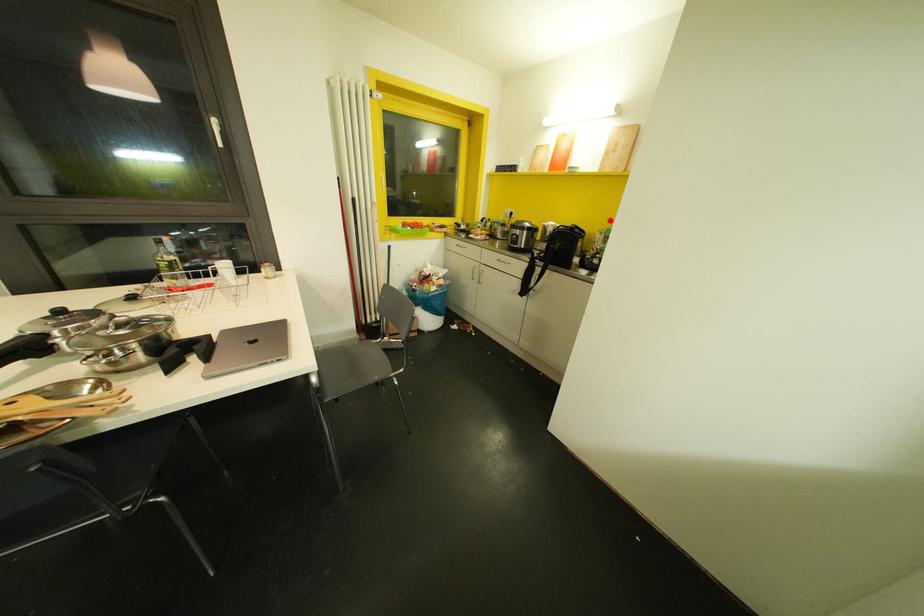
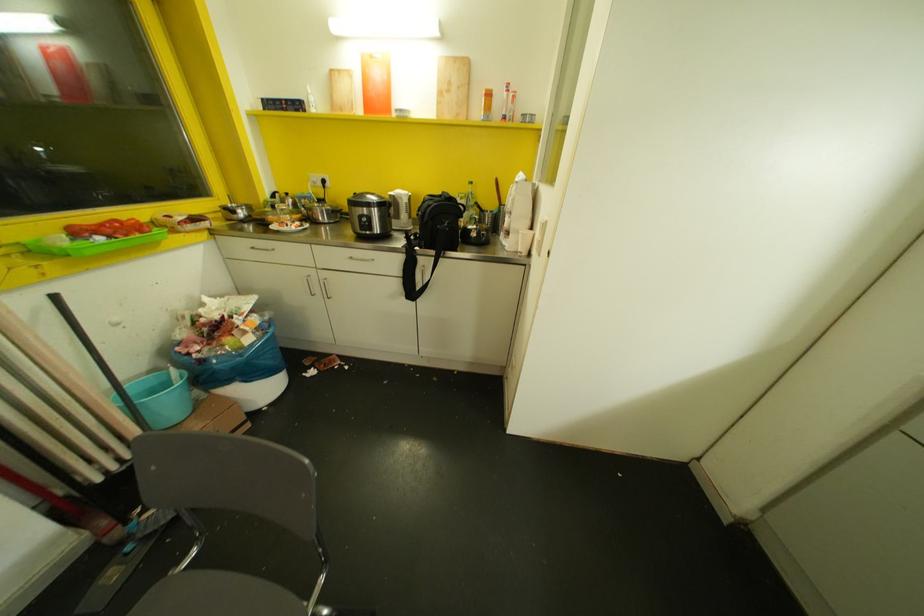
The point at the highlighted location is marked in the first image. Where is the corresponding point in the second image?

(469, 182)